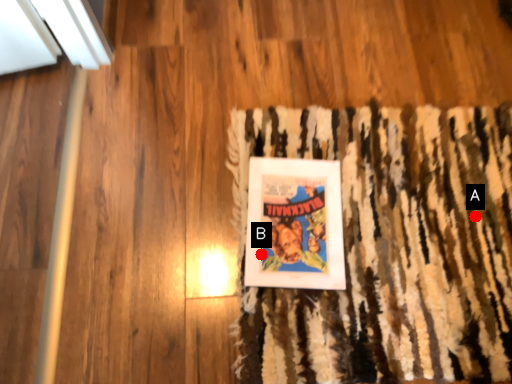
Question: Two points are circled on the image, labeled by A and B beside each circle. Which point is closer to the camera taking this photo?

Choices:
 (A) A is closer
 (B) B is closer

Answer: (B)